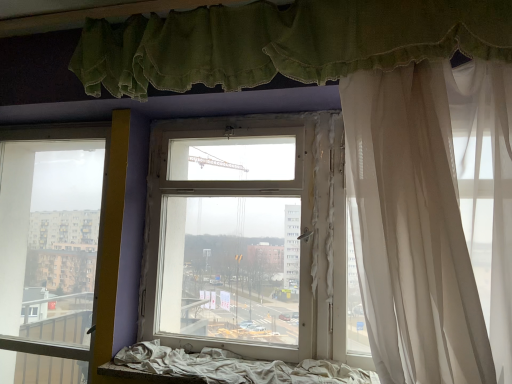
Question: In the image, is white fabric bed frame at lower center positioned in front of or behind transparent glass window at left, arranged as the 2th window when viewed from the right?

Choices:
 (A) behind
 (B) front

Answer: (B)

Question: From the image's perspective, relative to transparent glass window at left, placed as the first window when sorted from left to right, is white fabric bed frame at lower center above or below?

Choices:
 (A) above
 (B) below

Answer: (B)

Question: Which object is positioned farthest from the transparent glass window at left, arranged as the 2th window when viewed from the right?

Choices:
 (A) white fabric bed frame at lower center
 (B) white sheer curtain at right, positioned as the 1th curtain in bottom-to-top order
 (C) transparent glass window at center, placed as the 2th window when sorted from left to right
 (D) green fabric curtain at upper center, positioned as the 1th curtain in top-to-bottom order

Answer: (B)

Question: Based on their relative distances, which object is farther from the transparent glass window at center, placed as the 2th window when sorted from left to right?

Choices:
 (A) white sheer curtain at right, the second curtain from the top
 (B) green fabric curtain at upper center, the 2th curtain ordered from the bottom
 (C) transparent glass window at left, placed as the first window when sorted from left to right
 (D) white fabric bed frame at lower center

Answer: (C)